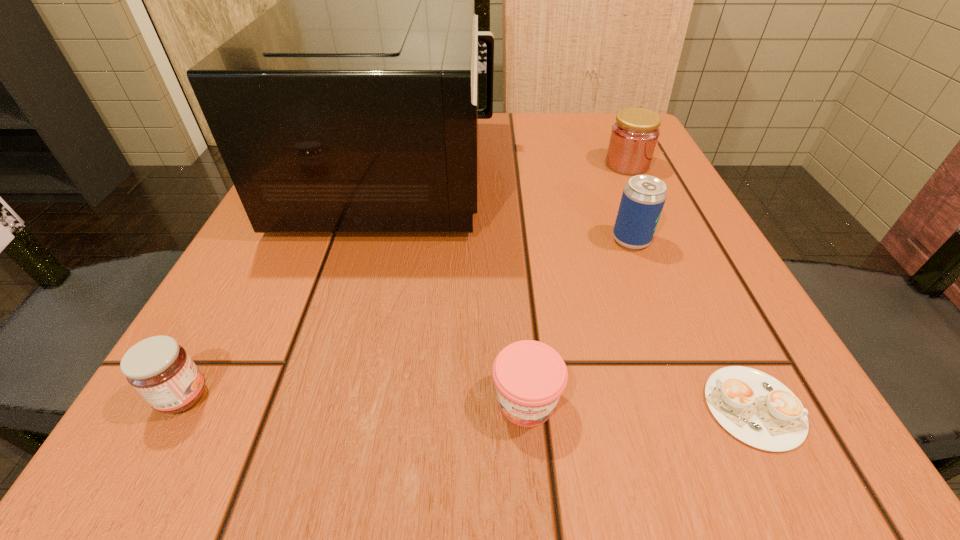
Where is `the tallest object`? This screenshot has height=540, width=960. the tallest object is located at coordinates (350, 106).

Where is `beer can`? The width and height of the screenshot is (960, 540). beer can is located at coordinates (643, 198).

At what (x,y) coordinates should I click in order to perform the action: click on the farthest jam. Please return your answer as a coordinate pair (x, y). This screenshot has height=540, width=960. Looking at the image, I should click on (634, 136).

Identify the location of the tallest jam. (634, 136).

The image size is (960, 540). What are the coordinates of `the leftmost jam` in the screenshot? It's located at (158, 368).

Where is `the second shortest jam`? Image resolution: width=960 pixels, height=540 pixels. the second shortest jam is located at coordinates (158, 368).

Find the location of a particular element. Image resolution: width=960 pixels, height=540 pixels. the second jam from right to left is located at coordinates (530, 376).

Where is `the fifth tallest object`? This screenshot has height=540, width=960. the fifth tallest object is located at coordinates (530, 376).

Where is `cappuccino`? The width and height of the screenshot is (960, 540). cappuccino is located at coordinates (756, 408).

At what (x,y) coordinates should I click in order to perform the action: click on free space located on the front-facing side of the microwave_oven. Please return your answer as a coordinate pair (x, y). This screenshot has width=960, height=540. Looking at the image, I should click on (652, 172).